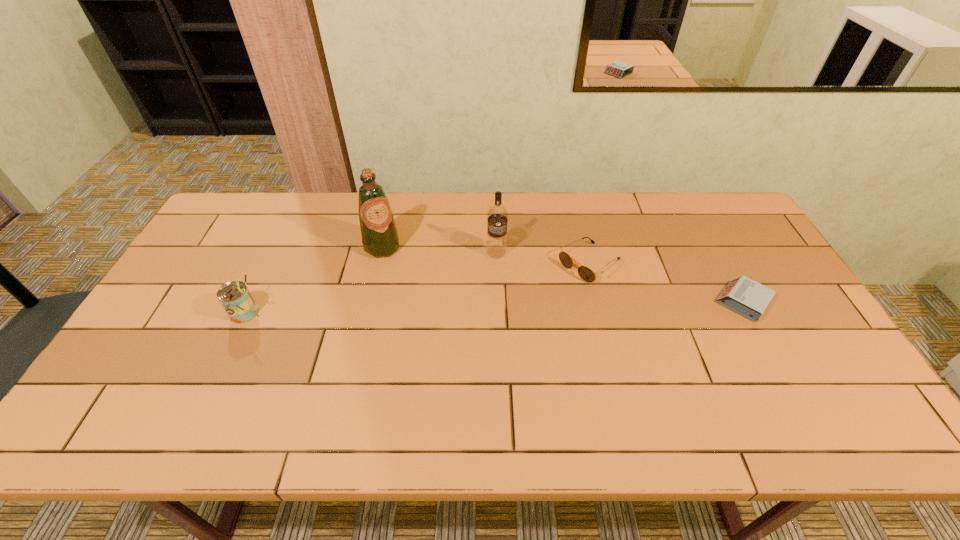
Where is `free spot that satisfies the following two spatial constraints: 1. on the front side of the second object from left to right; 2. on the right side of the third object from left to right`? The height and width of the screenshot is (540, 960). free spot that satisfies the following two spatial constraints: 1. on the front side of the second object from left to right; 2. on the right side of the third object from left to right is located at coordinates (381, 252).

You are a GUI agent. You are given a task and a screenshot of the screen. Output one action in this format:
    pyautogui.click(x=<x>, y=<y>)
    Task: Click on the free space in the image that satisfies the following two spatial constraints: 1. on the front side of the third object from right to left; 2. on the right side of the fourth object from right to left
    The height and width of the screenshot is (540, 960).
    Given the screenshot: What is the action you would take?
    pyautogui.click(x=381, y=252)